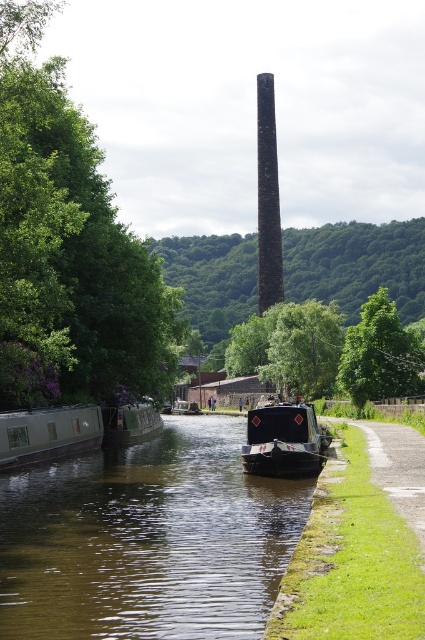
Is point (291, 416) positioned before point (278, 285)?

That is True.

Between point (291, 461) and point (266, 285), which one is positioned in front?

Point (291, 461)

Where is `black glossy boat at center`? black glossy boat at center is located at coordinates (283, 442).

Is matte black boat at left below green matte boat at left?

Actually, matte black boat at left is above green matte boat at left.

Is matte black boat at left closer to the viewer compared to green matte boat at left?

Yes.

You are a GUI agent. You are given a task and a screenshot of the screen. Output one action in this format:
    pyautogui.click(x=<x>, y=<y>)
    Task: Click on the matte black boat at left
    
    Given the screenshot: What is the action you would take?
    pyautogui.click(x=48, y=433)

Does brown smooth water at center have a greater height compared to matte black boat at left?

No.

From the picture: Measure the distance between point (133, 524) and camera.

Point (133, 524) is 29.44 meters away from camera.

The image size is (425, 640). What do you see at coordinates (147, 540) in the screenshot? I see `brown smooth water at center` at bounding box center [147, 540].

Locate an element on the screen. This screenshot has height=640, width=425. brown smooth water at center is located at coordinates (147, 540).